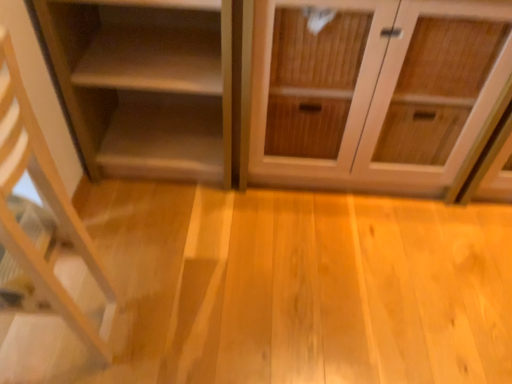
Where is `vacant region to the right of light wood shelf at left, which appears as the 1th shelf when viewed from the front`? The image size is (512, 384). vacant region to the right of light wood shelf at left, which appears as the 1th shelf when viewed from the front is located at coordinates (176, 318).